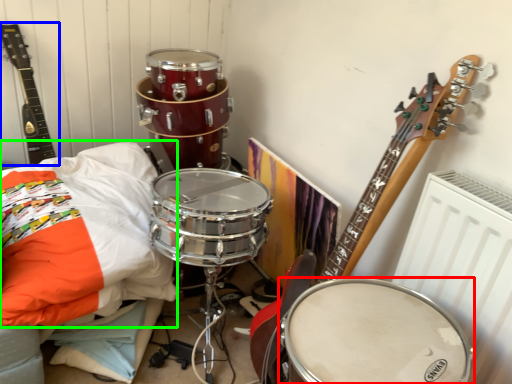
Question: Which object is the farthest from drum (highlighted by a red box)? Choose among these: guitar (highlighted by a blue box) or pillow (highlighted by a green box).

Choices:
 (A) guitar
 (B) pillow

Answer: (A)